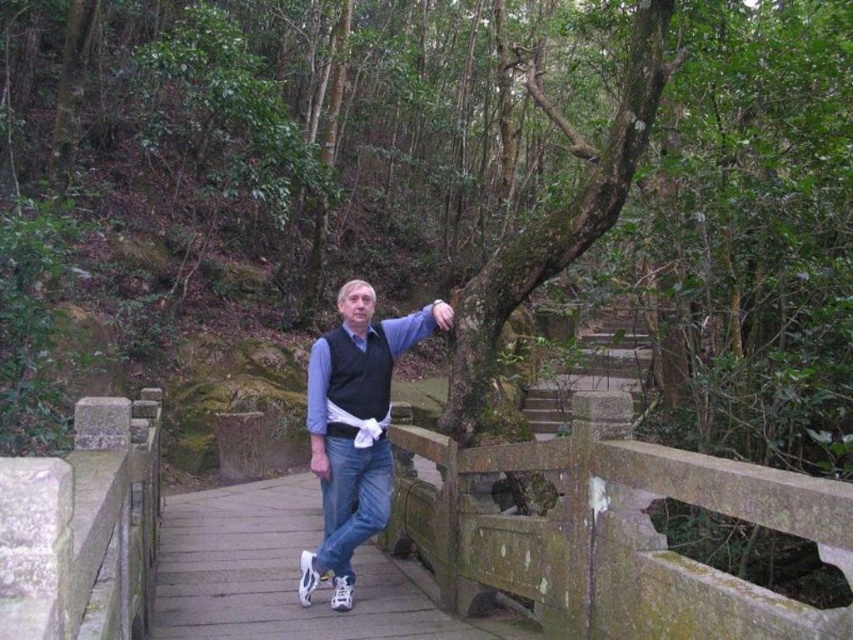
Is white leather sneakers at center wider than blue denim jeans at center?

Yes.

Can you confirm if white leather sneakers at center is positioned to the left of blue denim jeans at center?

Yes, white leather sneakers at center is to the left of blue denim jeans at center.

Identify the location of white leather sneakers at center. (286, 576).

In order to click on white leather sneakers at center in this screenshot , I will do `click(286, 576)`.

Is point (555, 636) in front of point (258, 573)?

Yes.

Does green mossy stone rail at lower center appear under white leather sneakers at center?

Actually, green mossy stone rail at lower center is above white leather sneakers at center.

Image resolution: width=853 pixels, height=640 pixels. What are the coordinates of `green mossy stone rail at lower center` in the screenshot? It's located at (611, 531).

Is point (724, 580) positioned before point (436, 301)?

Yes, it is.

Where is `green mossy stone rail at lower center`? This screenshot has width=853, height=640. green mossy stone rail at lower center is located at coordinates (611, 531).

Does point (669, 492) lie behind point (363, 410)?

No, (669, 492) is closer to viewer.

Locate an element on the screen. Image resolution: width=853 pixels, height=640 pixels. green mossy stone rail at lower center is located at coordinates (611, 531).